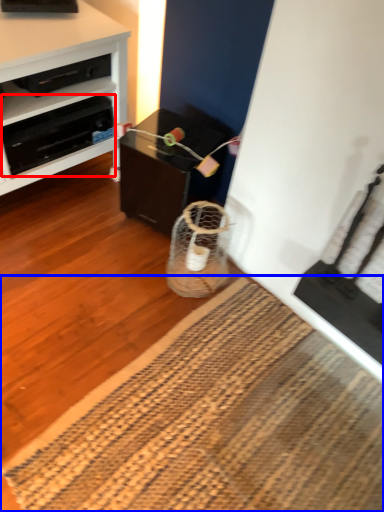
Question: Which of the following is the closest to the observer, drawer (highlighted by a red box) or mat (highlighted by a blue box)?

Choices:
 (A) drawer
 (B) mat

Answer: (B)